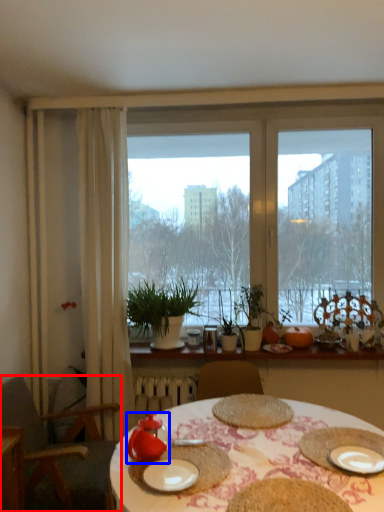
Question: Which object is further to the camera taking this photo, chair (highlighted by a red box) or tableware (highlighted by a blue box)?

Choices:
 (A) chair
 (B) tableware

Answer: (A)